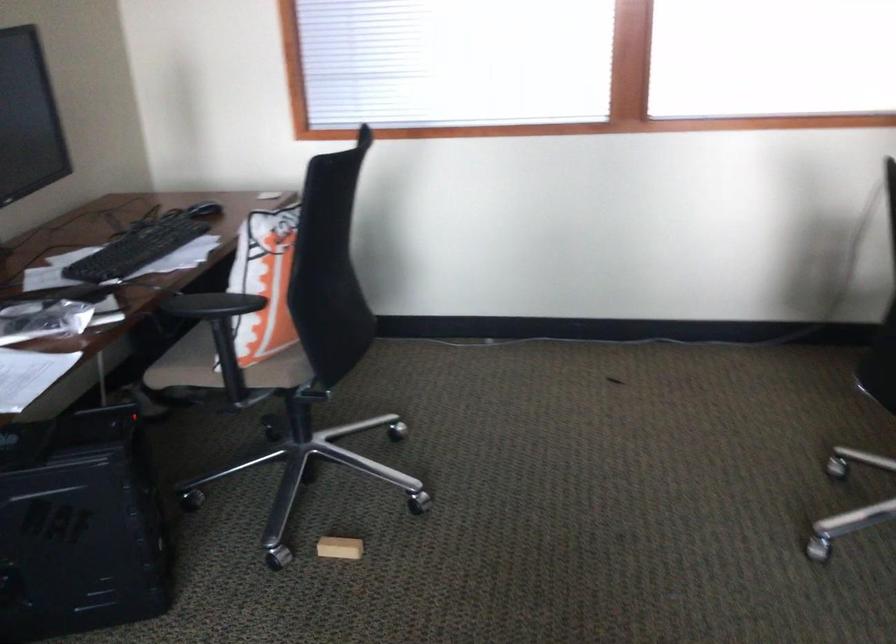
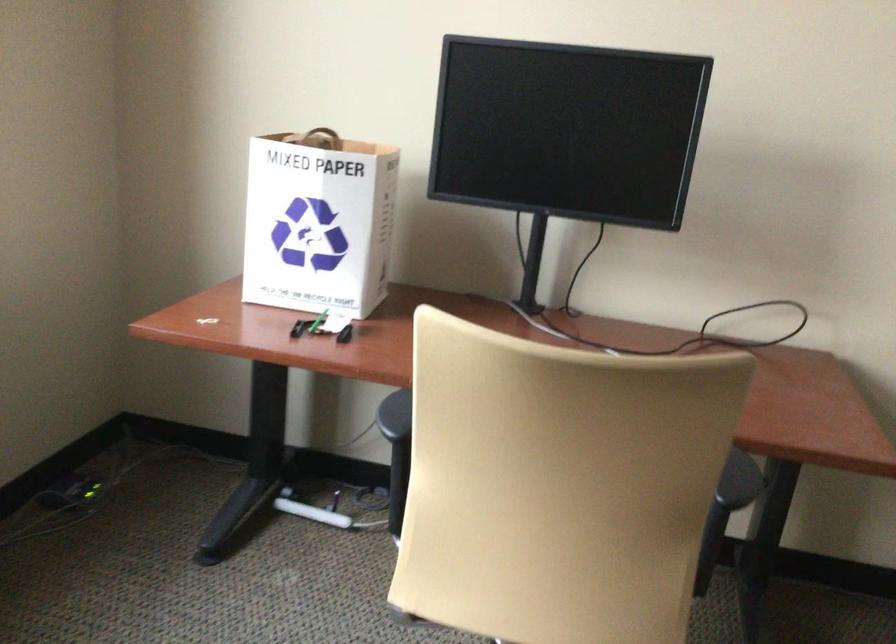
From the picture: The first image is from the beginning of the video and the second image is from the end. How did the camera likely rotate when shooting the video?

The rotation direction of the camera is left-down.